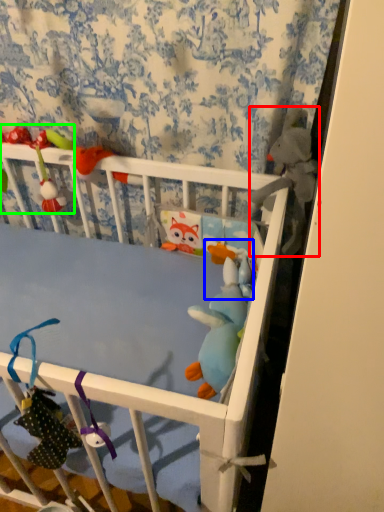
Question: Estimate the real-world distances between objects in this image. Which object is farther from toy (highlighted by a red box), toy (highlighted by a blue box) or toy (highlighted by a green box)?

Choices:
 (A) toy
 (B) toy

Answer: (B)